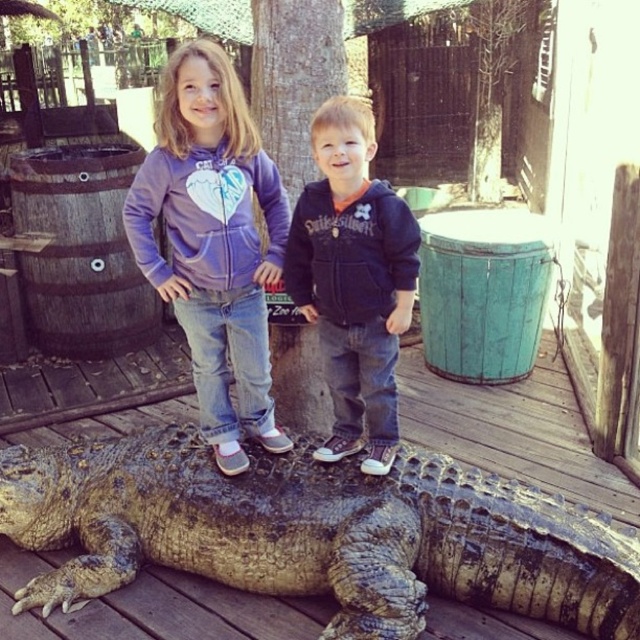
Which is more to the left, leathery brown crocodile at center or purple fleece hoodie at center?

purple fleece hoodie at center

The width and height of the screenshot is (640, 640). What do you see at coordinates (316, 532) in the screenshot? I see `leathery brown crocodile at center` at bounding box center [316, 532].

Identify the location of leathery brown crocodile at center. Image resolution: width=640 pixels, height=640 pixels. (316, 532).

Where is `leathery brown crocodile at center`? The image size is (640, 640). leathery brown crocodile at center is located at coordinates (316, 532).

Does purple fleece hoodie at center have a lesser height compared to dark blue hoodie at center?

No, purple fleece hoodie at center is not shorter than dark blue hoodie at center.

Is the position of purple fleece hoodie at center more distant than that of dark blue hoodie at center?

That is True.

Is point (202, 218) more distant than point (330, 228)?

Yes, it is.

Where is `purple fleece hoodie at center`? purple fleece hoodie at center is located at coordinates [x=212, y=243].

Between point (60, 451) and point (321, 220), which one is positioned behind?

The point (60, 451) is more distant.

Where is `leathery brown crocodile at center`? The width and height of the screenshot is (640, 640). leathery brown crocodile at center is located at coordinates (316, 532).

Is point (403, 467) positioned before point (333, 179)?

No, (403, 467) is further to viewer.

The image size is (640, 640). I want to click on leathery brown crocodile at center, so click(316, 532).